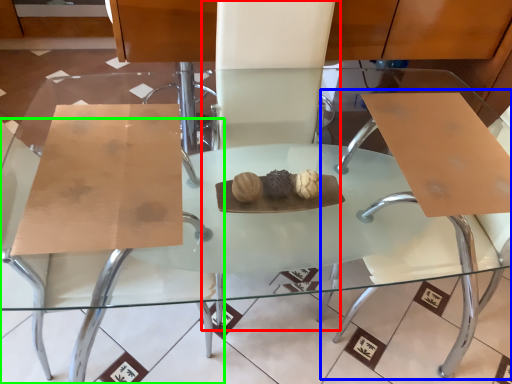
Question: Estimate the real-world distances between objects in this image. Which object is farther from chair (highlighted by a red box), swivel chair (highlighted by a blue box) or chair (highlighted by a green box)?

Choices:
 (A) swivel chair
 (B) chair

Answer: (B)